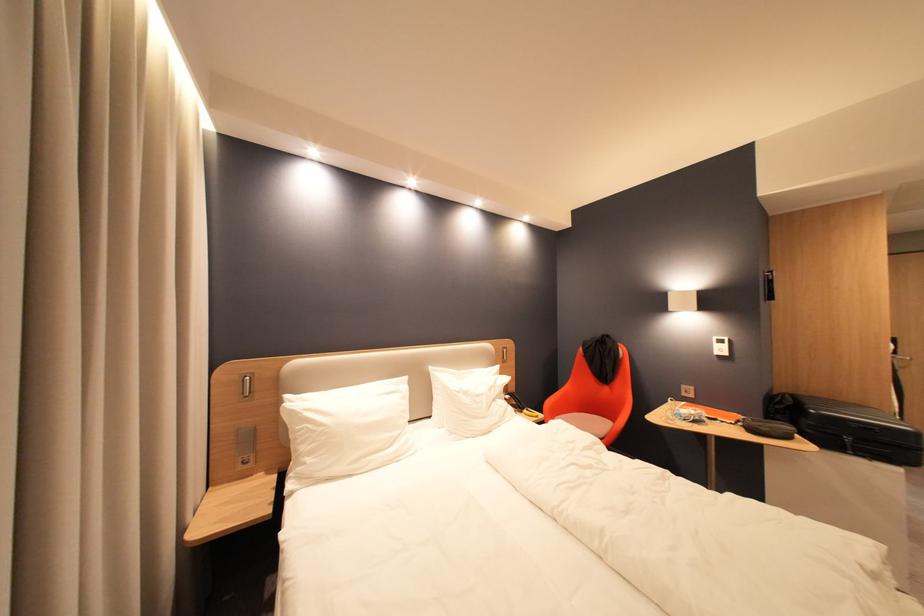
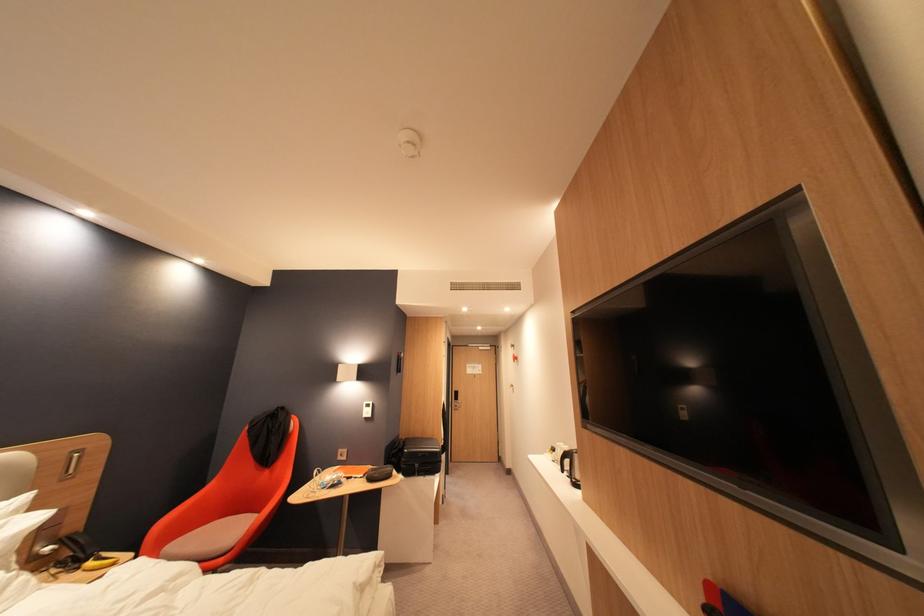
Question: I am providing you with two images of the same scene from different viewpoints. Please identify which objects are invisible in image2.

Choices:
 (A) black case
 (B) black kettle handle
 (C) red chair sitting surface
 (D) none of these

Answer: (D)